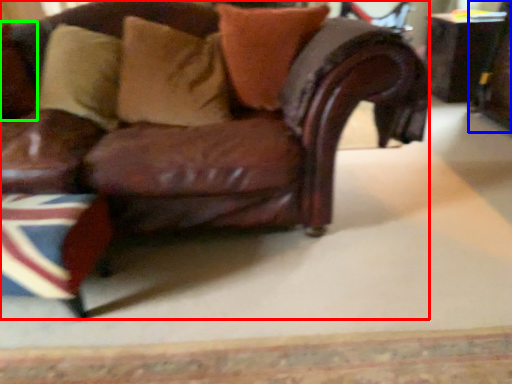
Question: Based on their relative distances, which object is nearer to chair (highlighted by a red box)? Choose from swivel chair (highlighted by a blue box) and pillow (highlighted by a green box).

Choices:
 (A) swivel chair
 (B) pillow

Answer: (B)